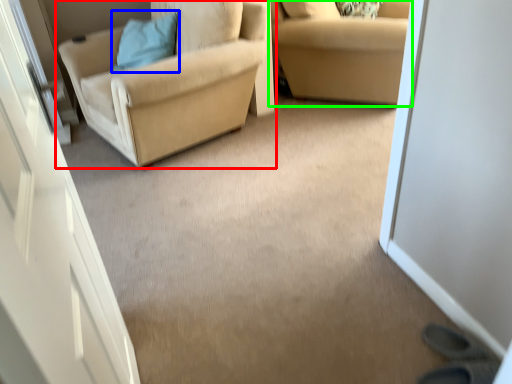
Question: Which is farther away from chair (highlighted by a red box)? pillow (highlighted by a blue box) or studio couch (highlighted by a green box)?

Choices:
 (A) pillow
 (B) studio couch

Answer: (B)